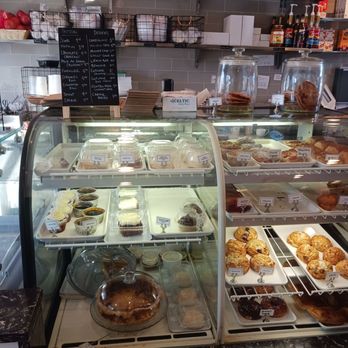
Find the location of a particular element. The height and width of the screenshot is (348, 348). wall is located at coordinates point(155,71), point(13,53), point(224,11), point(171,9).